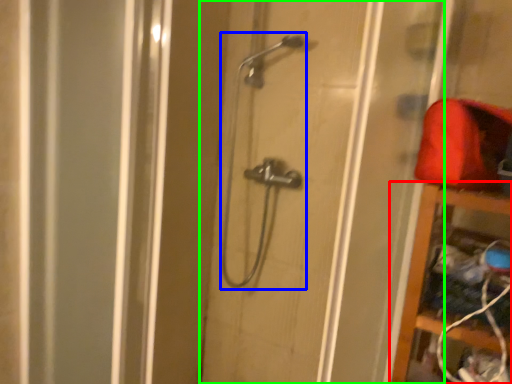
Question: Considering the real-world distances, which object is closest to cabinet (highlighted by a red box)? shower (highlighted by a blue box) or door (highlighted by a green box).

Choices:
 (A) shower
 (B) door

Answer: (B)